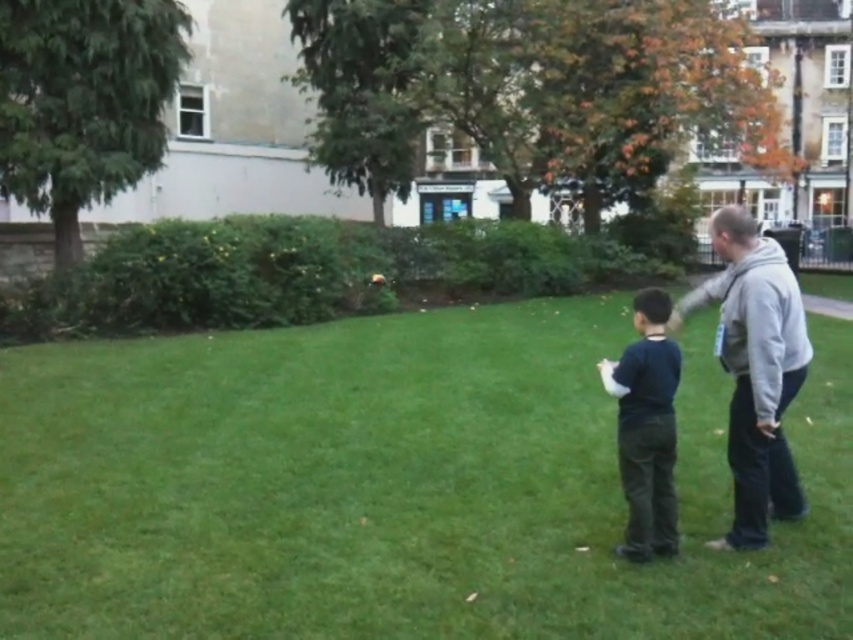
Does gray fleece jacket at right appear on the left side of dark blue shirt at center?

No, gray fleece jacket at right is not to the left of dark blue shirt at center.

Between gray fleece jacket at right and dark blue shirt at center, which one has more height?

Standing taller between the two is gray fleece jacket at right.

Locate an element on the screen. gray fleece jacket at right is located at coordinates (755, 369).

Locate an element on the screen. The image size is (853, 640). gray fleece jacket at right is located at coordinates (755, 369).

Who is positioned more to the right, green grass at center or dark blue shirt at center?

From the viewer's perspective, dark blue shirt at center appears more on the right side.

Is green grass at center above dark blue shirt at center?

No, green grass at center is not above dark blue shirt at center.

The image size is (853, 640). I want to click on green grass at center, so click(396, 484).

Based on the photo, is green grass at center to the right of gray fleece jacket at right from the viewer's perspective?

No, green grass at center is not to the right of gray fleece jacket at right.

Between point (440, 312) and point (759, 333), which one is positioned behind?

Point (440, 312)

At what (x,y) coordinates should I click in order to perform the action: click on green grass at center. Please return your answer as a coordinate pair (x, y). Image resolution: width=853 pixels, height=640 pixels. Looking at the image, I should click on tap(396, 484).